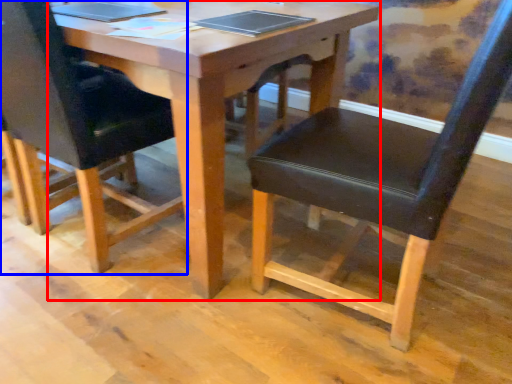
Question: Which point is further to the camera, table (highlighted by a red box) or chair (highlighted by a blue box)?

Choices:
 (A) table
 (B) chair

Answer: (B)